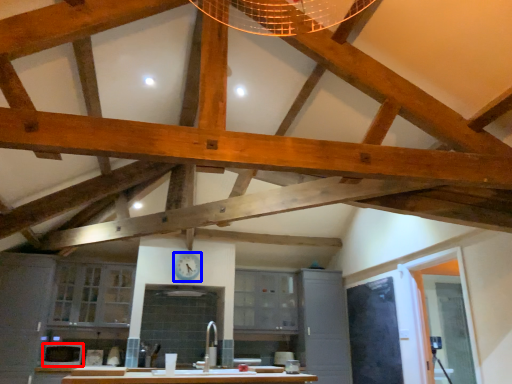
Question: Which object appears farthest to the camera in this image, appliance (highlighted by a red box) or clock (highlighted by a blue box)?

Choices:
 (A) appliance
 (B) clock

Answer: (B)